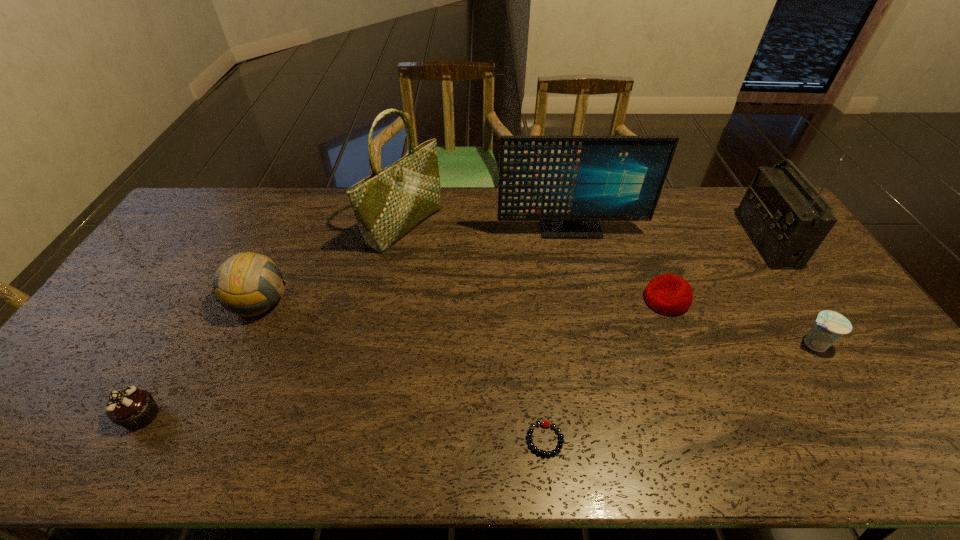
The image size is (960, 540). Identify the location of free area in between the beanbag and the computer monitor. pos(618,265).

The image size is (960, 540). Identify the location of free space between the fifth shortest object and the sixth shortest object. (415, 266).

Locate an element on the screen. The image size is (960, 540). vacant region between the second shortest object and the fifth shortest object is located at coordinates (464, 301).

Where is `object that is the fourth closest one to the fourth tallest object`? The height and width of the screenshot is (540, 960). object that is the fourth closest one to the fourth tallest object is located at coordinates coord(544,423).

Locate an element on the screen. object that is the fifth closest one to the sixth object from right to left is located at coordinates (669, 294).

Identify the location of vacant space that satisfies the following two spatial constraints: 1. on the screen side of the yogurt; 2. on the right side of the third tallest object. Image resolution: width=960 pixels, height=540 pixels. (595, 344).

This screenshot has height=540, width=960. Identify the location of vacant space that satisfies the following two spatial constraints: 1. on the seat area of the seventh tallest object; 2. on the right side of the yogurt. (684, 344).

This screenshot has width=960, height=540. I want to click on free space that satisfies the following two spatial constraints: 1. on the front side of the volleyball; 2. on the left side of the third nearest object, so click(x=241, y=344).